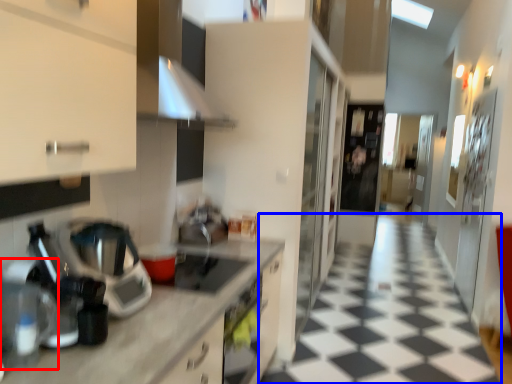
Question: Which object is further to the camera taking this photo, coffee machine (highlighted by a red box) or tile (highlighted by a blue box)?

Choices:
 (A) coffee machine
 (B) tile

Answer: (B)